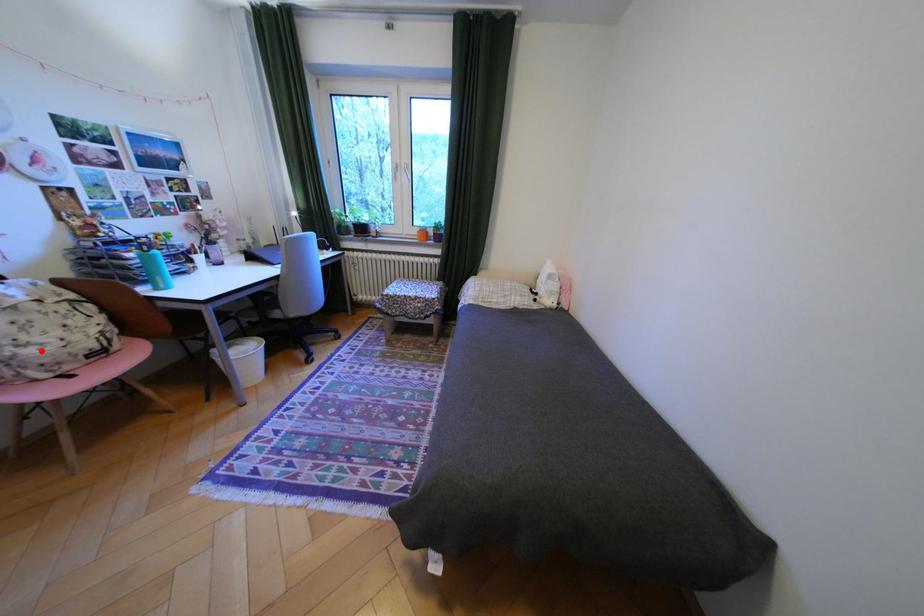
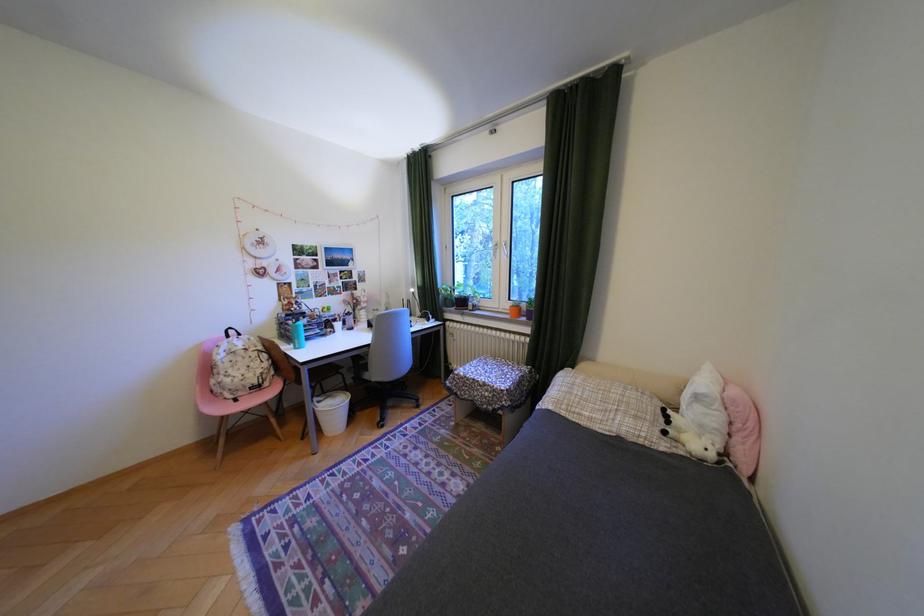
The point at the highlighted location is marked in the first image. Where is the corresponding point in the second image?

(239, 379)